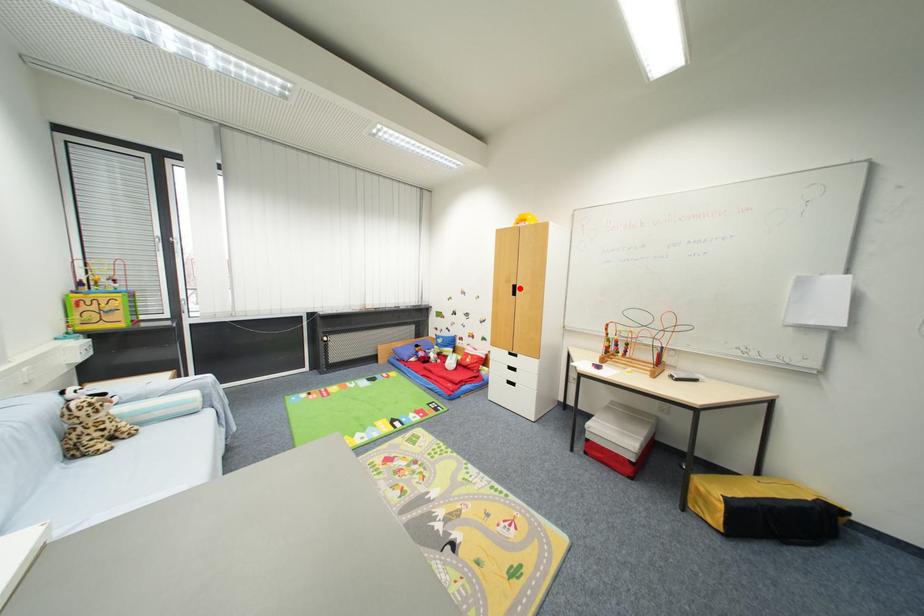
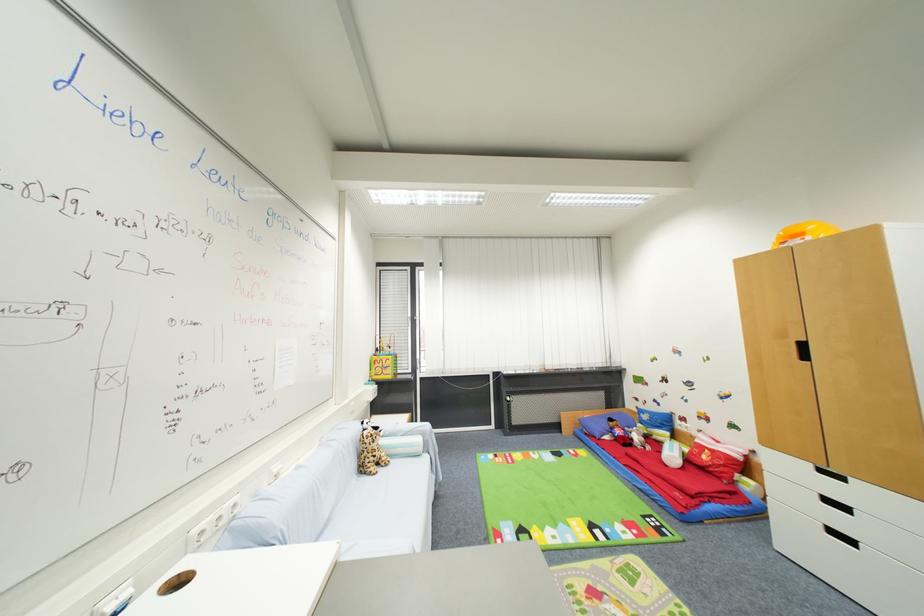
In the second image, find the point that corresponds to the highlighted location in the first image.

(808, 346)